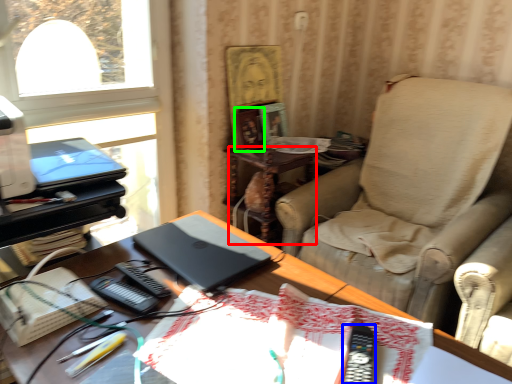
Question: Estimate the real-world distances between objects in this image. Which object is farther from side table (highlighted by a red box), equipment (highlighted by a blue box) or picture frame (highlighted by a green box)?

Choices:
 (A) equipment
 (B) picture frame

Answer: (A)